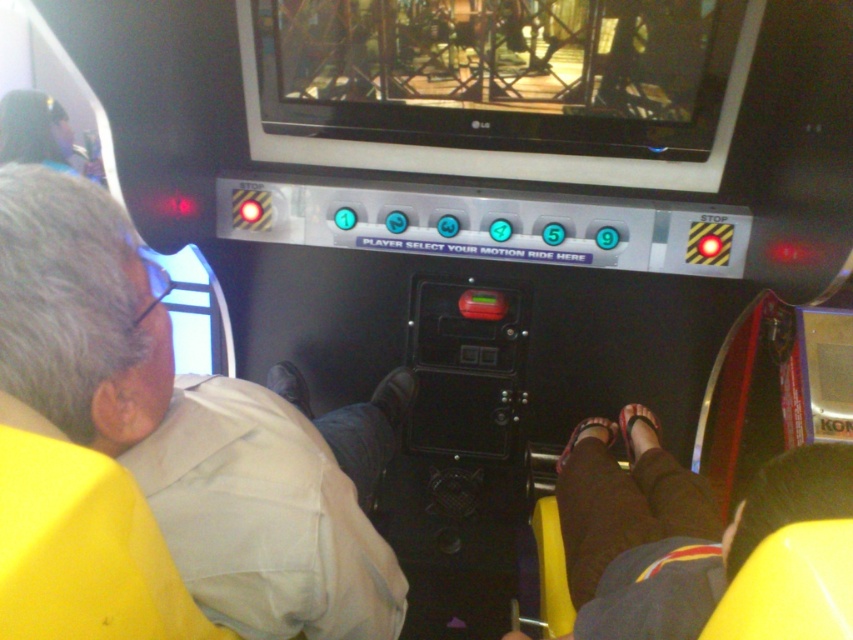
Who is higher up, matte pink sandal at lower center or brown fabric sandal at center?

matte pink sandal at lower center

Does matte pink sandal at lower center appear under brown fabric sandal at center?

No.

Between point (637, 420) and point (608, 436), which one is positioned in front?

Point (637, 420) is in front.

Where is `matte pink sandal at lower center`? matte pink sandal at lower center is located at coordinates (637, 429).

Is point (1, 339) closer to viewer compared to point (630, 435)?

That is True.

Based on the photo, is beige fabric shirt at left above matte pink sandal at lower center?

Indeed, beige fabric shirt at left is positioned over matte pink sandal at lower center.

Which is behind, point (196, 538) or point (624, 435)?

The point (624, 435) is behind.

I want to click on beige fabric shirt at left, so click(189, 426).

You are a GUI agent. You are given a task and a screenshot of the screen. Output one action in this format:
    pyautogui.click(x=<x>, y=<y>)
    Task: Click on the beige fabric shirt at left
    This screenshot has width=853, height=640.
    Given the screenshot: What is the action you would take?
    pyautogui.click(x=189, y=426)

Is point (317, 586) positioned behind point (556, 460)?

No.

Does point (277, 448) lie behind point (601, 428)?

That is False.

Find the location of `beige fabric shirt at left`. beige fabric shirt at left is located at coordinates (189, 426).